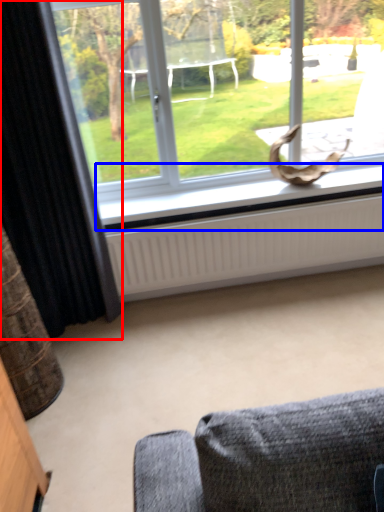
Question: Among these objects, which one is nearest to the camera, curtain (highlighted by a red box) or window sill (highlighted by a blue box)?

Choices:
 (A) curtain
 (B) window sill

Answer: (A)